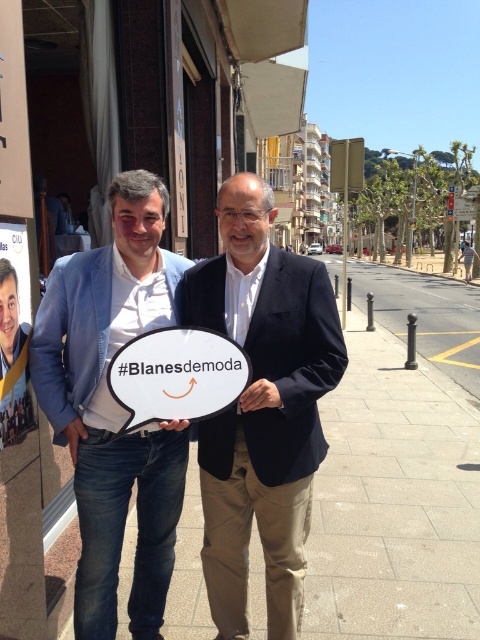
You are a photographer trying to capture the black matte suit at center in the image. What are the coordinates where you should focus your camera?

The black matte suit at center is located at coordinates point (262, 406).

What is the object located at the coordinates point (262, 406) in the image?

The object located at point (262, 406) is the black matte suit at center.

You are a photographer setting up a shot of the two men holding the sign. You want to focus on the white concrete pavement at center and the blue denim jeans at lower left. Which object should you adjust your camera to be closer to in order to capture both in focus?

The white concrete pavement at center is further to the viewer than the blue denim jeans at lower left, so you should adjust your camera to be closer to the blue denim jeans at lower left to ensure both are in focus.